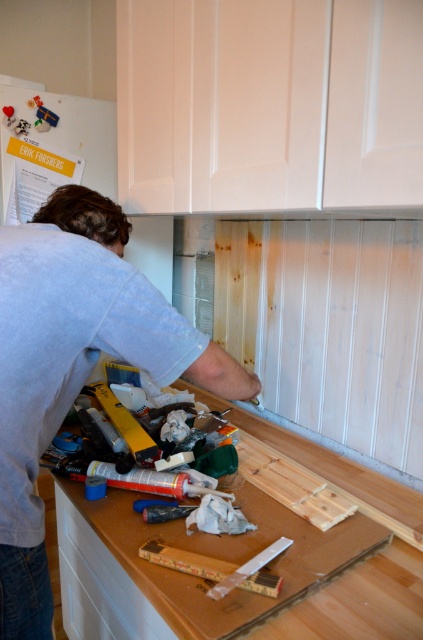
Question: Which object is positioned closest to the gray cotton shirt at center?

Choices:
 (A) wooden drawer at lower left
 (B) wooden ruler at center
 (C) wooden at center

Answer: (B)

Question: Can you confirm if wooden at center is smaller than wooden ruler at center?

Choices:
 (A) yes
 (B) no

Answer: (B)

Question: Is wooden drawer at lower left positioned before wooden ruler at center?

Choices:
 (A) no
 (B) yes

Answer: (A)

Question: Is wooden at center positioned before wooden drawer at lower left?

Choices:
 (A) no
 (B) yes

Answer: (B)

Question: Which point is farther to the camera?

Choices:
 (A) (57, 595)
 (B) (117, 564)

Answer: (A)

Question: Which point appears closest to the camera in this image?

Choices:
 (A) 275,627
 (B) 186,572

Answer: (A)